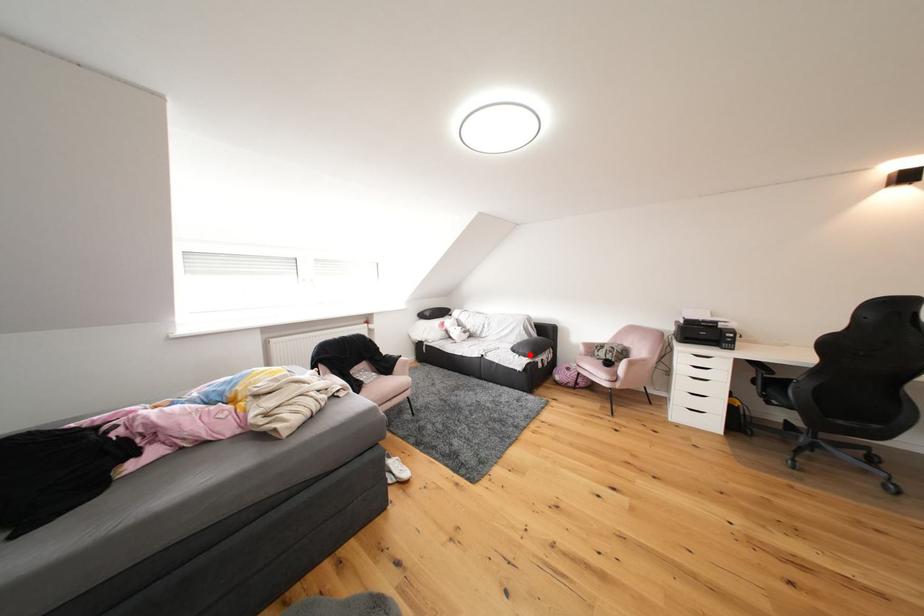
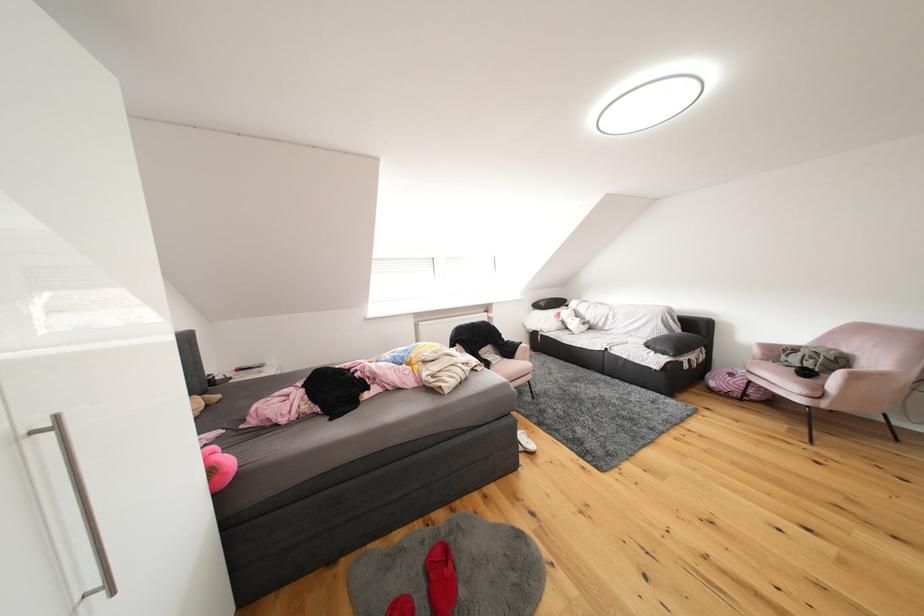
Question: I am providing you with two images of the same scene from different viewpoints. Given a red point in image1, look at the same physical point in image2. Is it:

Choices:
 (A) Closer to the viewpoint
 (B) Farther from the viewpoint

Answer: (A)